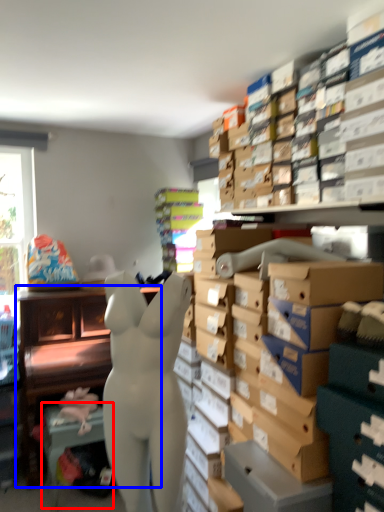
Question: Which object is closer to the camera taking this photo, table (highlighted by a red box) or furniture (highlighted by a blue box)?

Choices:
 (A) table
 (B) furniture

Answer: (A)